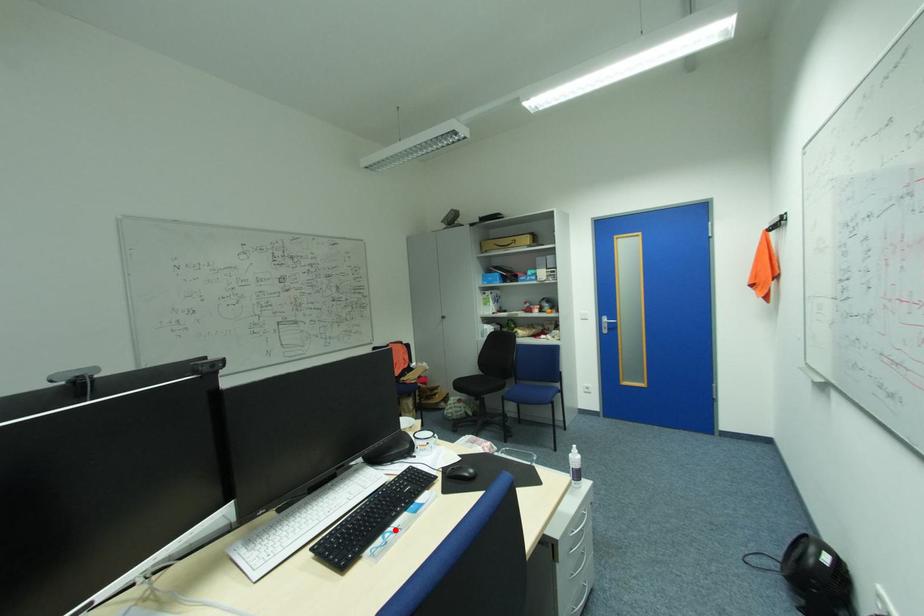
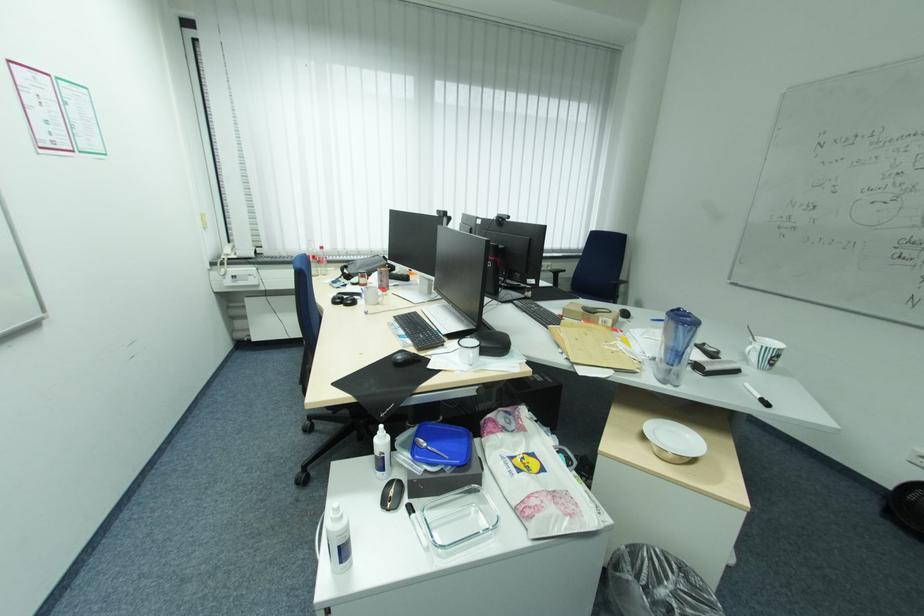
The point at the highlighted location is marked in the first image. Where is the corresponding point in the second image?

(407, 329)